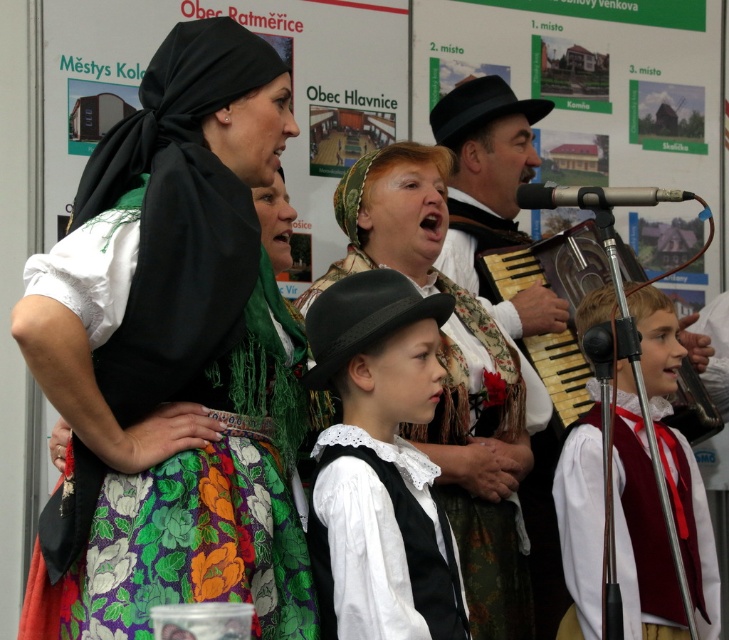
Consider the image. You are a photographer at the event and want to capture both the floral fabric dress at center and the wooden accordion at center in a single frame. Which object should you focus on first to ensure both are in the shot?

The floral fabric dress at center is wider than the wooden accordion at center, so you should focus on the floral fabric dress at center first to ensure both are in the shot.

You are a photographer standing at the entrance of the venue. You want to take a photo of the wooden accordion at center. Where should you aim your camera to capture it?

The wooden accordion at center is located at point 0.464 on the horizontal axis and 0.767 on the vertical axis, so you should aim your camera towards those coordinates to capture it.

You are an event planner arranging a stage layout for a cultural performance. The stage has a limited space between the front edge and the backdrop. You need to ensure that the floral fabric dress at center and the wooden accordion at center can be placed without overlapping. Given that the vertical space is constrained, which object should be positioned higher to avoid overlapping?

The wooden accordion at center should be positioned higher than the floral fabric dress at center since the floral fabric dress at center is located below the wooden accordion at center in the original image.